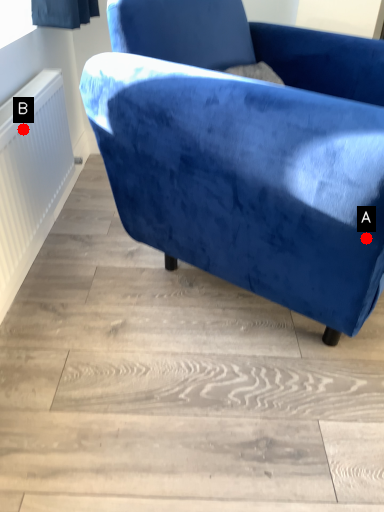
Question: Two points are circled on the image, labeled by A and B beside each circle. Which point appears closest to the camera in this image?

Choices:
 (A) A is closer
 (B) B is closer

Answer: (A)